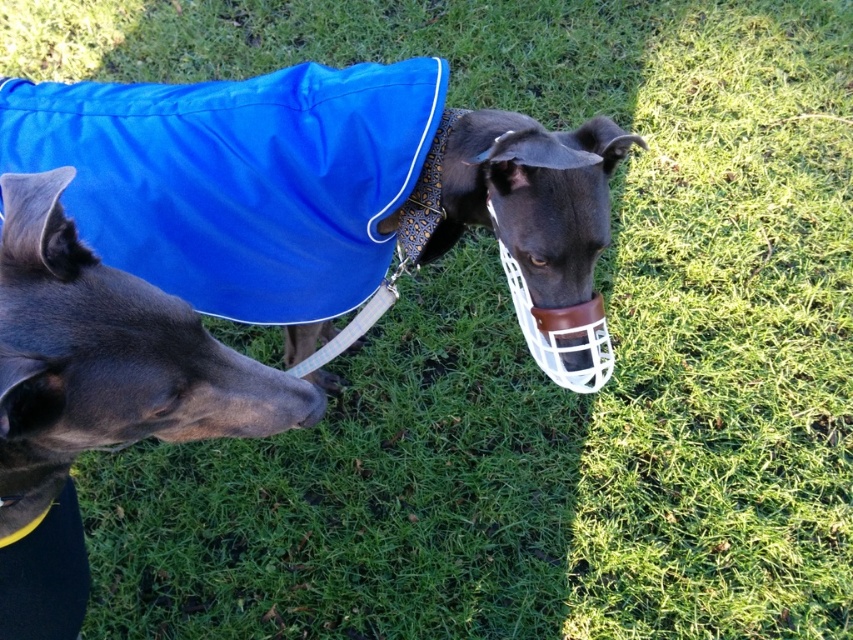
The height and width of the screenshot is (640, 853). Describe the element at coordinates (328, 196) in the screenshot. I see `shiny blue coat at center` at that location.

Is point (550, 140) less distant than point (68, 516)?

That is True.

The width and height of the screenshot is (853, 640). What are the coordinates of `shiny blue coat at center` in the screenshot? It's located at (328, 196).